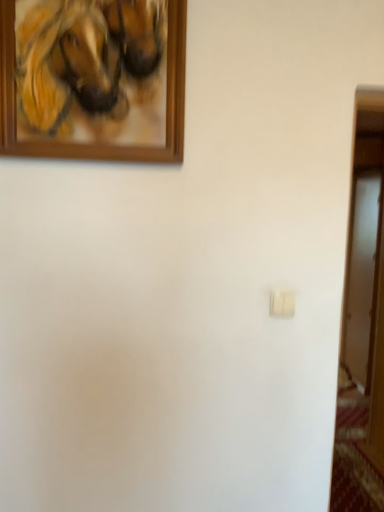
The width and height of the screenshot is (384, 512). Describe the element at coordinates (93, 79) in the screenshot. I see `wooden picture frame at upper left` at that location.

Locate an element on the screen. The height and width of the screenshot is (512, 384). wooden picture frame at upper left is located at coordinates (93, 79).

Image resolution: width=384 pixels, height=512 pixels. What do you see at coordinates (282, 303) in the screenshot?
I see `white matte light switch at center` at bounding box center [282, 303].

You are a GUI agent. You are given a task and a screenshot of the screen. Output one action in this format:
    pyautogui.click(x=<x>, y=<y>)
    Task: Click on the white matte light switch at center
    The height and width of the screenshot is (512, 384).
    Given the screenshot: What is the action you would take?
    pyautogui.click(x=282, y=303)

What are the coordinates of `wooden picture frame at upper left` in the screenshot? It's located at [93, 79].

From the picture: Is wooden picture frame at upper left to the left of white matte light switch at center from the viewer's perspective?

Yes.

Does wooden picture frame at upper left lie in front of white matte light switch at center?

Yes, wooden picture frame at upper left is closer to the viewer.

Is point (20, 118) positioned in front of point (286, 293)?

Yes, it is.

From the image's perspective, which object appears higher, wooden picture frame at upper left or white matte light switch at center?

wooden picture frame at upper left.

From a real-world perspective, relative to white matte light switch at center, is wooden picture frame at upper left vertically above or below?

In terms of real-world spatial position, wooden picture frame at upper left is above white matte light switch at center.

In terms of width, does wooden picture frame at upper left look wider or thinner when compared to white matte light switch at center?

Clearly, wooden picture frame at upper left has more width compared to white matte light switch at center.

Can you confirm if wooden picture frame at upper left is shorter than white matte light switch at center?

No, wooden picture frame at upper left is not shorter than white matte light switch at center.

Between wooden picture frame at upper left and white matte light switch at center, which one has smaller size?

white matte light switch at center is smaller.

Choose the correct answer: Is wooden picture frame at upper left inside white matte light switch at center or outside it?

wooden picture frame at upper left exists outside the volume of white matte light switch at center.

Is wooden picture frame at upper left not near white matte light switch at center?

No.

Could you tell me if wooden picture frame at upper left is turned towards white matte light switch at center?

No, wooden picture frame at upper left is not aimed at white matte light switch at center.

Locate an element on the screen. The height and width of the screenshot is (512, 384). light switch behind the wooden picture frame at upper left is located at coordinates (282, 303).

Can you confirm if white matte light switch at center is positioned to the left of wooden picture frame at upper left?

No, white matte light switch at center is not to the left of wooden picture frame at upper left.

Is white matte light switch at center in front of or behind wooden picture frame at upper left in the image?

white matte light switch at center is positioned farther from the viewer than wooden picture frame at upper left.

Does point (283, 311) appear closer or farther from the camera than point (84, 85)?

Point (283, 311).

From the image's perspective, would you say white matte light switch at center is positioned over wooden picture frame at upper left?

No, from the image's perspective, white matte light switch at center is not on top of wooden picture frame at upper left.

From a real-world perspective, which is physically below, white matte light switch at center or wooden picture frame at upper left?

white matte light switch at center, from a real-world perspective.

Between white matte light switch at center and wooden picture frame at upper left, which one has larger width?

wooden picture frame at upper left is wider.

Who is taller, white matte light switch at center or wooden picture frame at upper left?

With more height is wooden picture frame at upper left.

Is white matte light switch at center bigger or smaller than wooden picture frame at upper left?

Clearly, white matte light switch at center is smaller in size than wooden picture frame at upper left.

Is white matte light switch at center inside or outside of wooden picture frame at upper left?

white matte light switch at center is spatially situated outside wooden picture frame at upper left.

Is white matte light switch at center directly adjacent to wooden picture frame at upper left?

white matte light switch at center and wooden picture frame at upper left are not in contact.

Is white matte light switch at center looking in the opposite direction of wooden picture frame at upper left?

No, wooden picture frame at upper left is not at the back of white matte light switch at center.

How many degrees apart are the facing directions of white matte light switch at center and wooden picture frame at upper left?

The angle between the facing direction of white matte light switch at center and the facing direction of wooden picture frame at upper left is 0.209 degrees.

The width and height of the screenshot is (384, 512). What are the coordinates of `picture frame above the white matte light switch at center (from the image's perspective)` in the screenshot? It's located at (93, 79).

Locate an element on the screen. The width and height of the screenshot is (384, 512). picture frame that is in front of the white matte light switch at center is located at coordinates (93, 79).

Locate an element on the screen. The height and width of the screenshot is (512, 384). light switch behind the wooden picture frame at upper left is located at coordinates (282, 303).